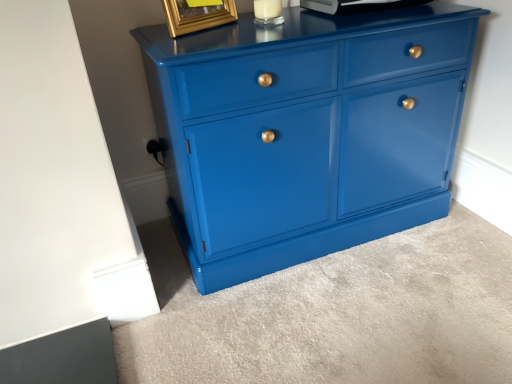
Where is `free space to the left of gold metallic picture frame at upper center`? free space to the left of gold metallic picture frame at upper center is located at coordinates (157, 34).